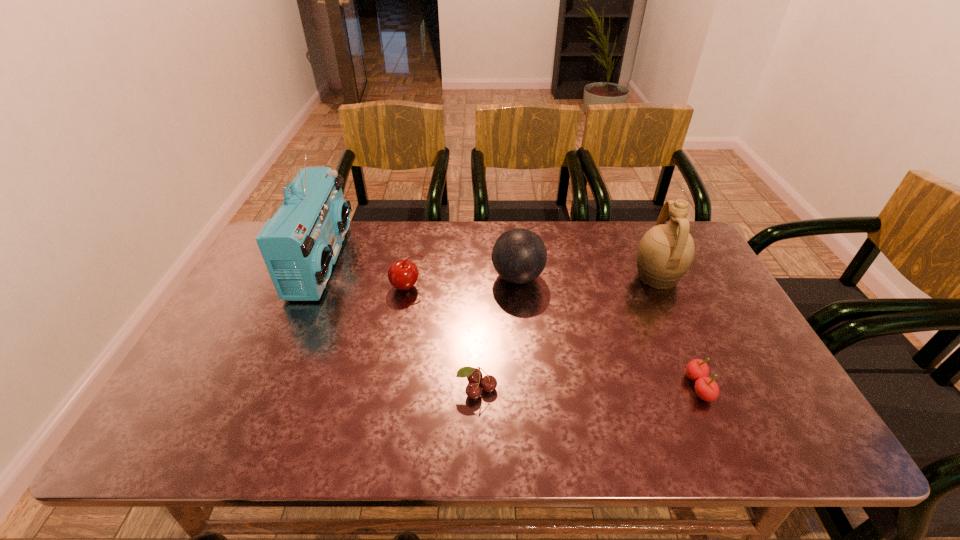
The image size is (960, 540). I want to click on vacant space that is in between the rightmost cherry and the third shortest object, so click(x=553, y=337).

At what (x,y) coordinates should I click in order to perform the action: click on vacant area that lies between the bowling ball and the second cherry from left to right. Please return your answer as a coordinate pair (x, y). The width and height of the screenshot is (960, 540). Looking at the image, I should click on (497, 333).

I want to click on free space that is in between the second tallest object and the second cherry from left to right, so click(x=566, y=333).

You are a GUI agent. You are given a task and a screenshot of the screen. Output one action in this format:
    pyautogui.click(x=<x>, y=<y>)
    Task: Click on the vacant area that lies between the second tallest object and the second object from left to right
    The image size is (960, 540).
    Given the screenshot: What is the action you would take?
    pyautogui.click(x=532, y=282)

Find the location of a particular element. free space between the third tallest object and the pitcher is located at coordinates (588, 277).

Image resolution: width=960 pixels, height=540 pixels. In order to click on vacant space in between the pitcher and the leftmost object in this screenshot , I will do `click(490, 269)`.

Image resolution: width=960 pixels, height=540 pixels. What are the coordinates of `vacant space that's between the tallest object and the bowling ball` in the screenshot? It's located at (x=420, y=269).

This screenshot has width=960, height=540. Find the location of `object that is the third closest to the rightmost cherry`. object that is the third closest to the rightmost cherry is located at coordinates (474, 376).

Where is `the fourth closest object to the leftmost cherry`? The height and width of the screenshot is (540, 960). the fourth closest object to the leftmost cherry is located at coordinates (665, 253).

Where is `cherry that can be found as the closest to the fourth tallest object`? cherry that can be found as the closest to the fourth tallest object is located at coordinates (474, 376).